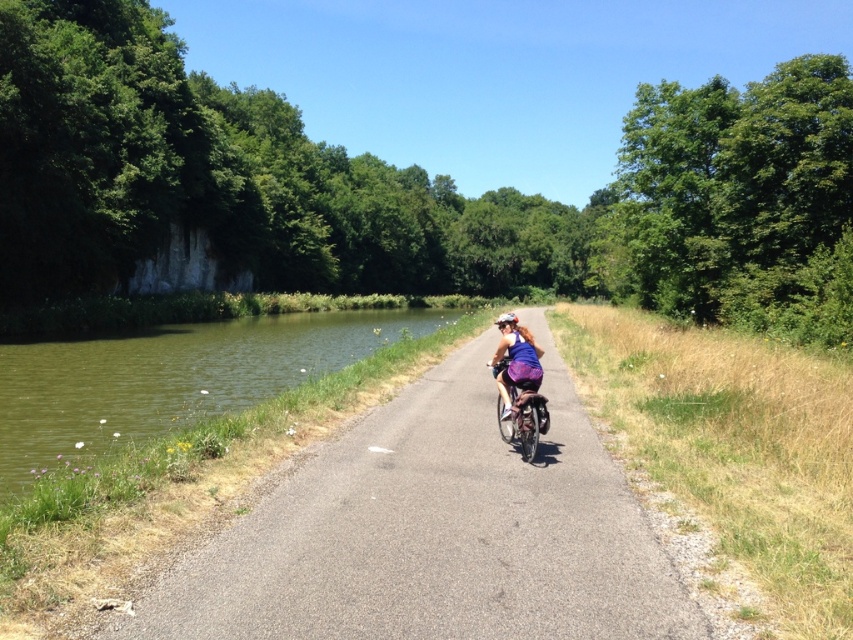
You are standing at the point labeled as point (434, 532), which is the asphalt road at center. You want to walk towards the dense trees and vegetation on one side of the path. Which direction should you go?

You should walk towards the direction of the dense trees and vegetation, which is the side opposite to the grassy areas and taller dry grasses. Since the asphalt road at center is flanked by dense trees on one side and grassy areas on the other, moving towards the trees would be the correct direction.

You are a photographer planning to take a photo of the purple fabric helmet at center and the metallic silver bicycle at center. If you want both objects to appear equally prominent in the photo, what adjustment should you make given their sizes?

The purple fabric helmet at center is larger in size than the metallic silver bicycle at center. To make both appear equally prominent, you should position the metallic silver bicycle at center closer to the camera while keeping the purple fabric helmet at center at a distance, as its larger size would compensate for its distance, balancing their apparent sizes in the photo.